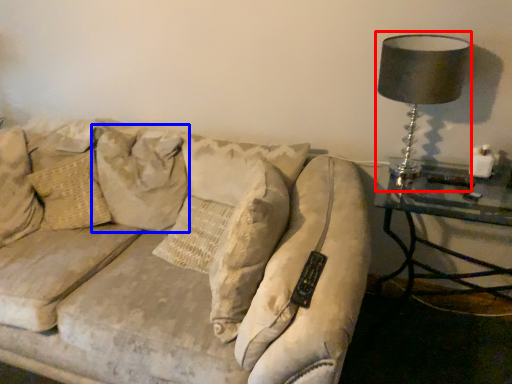
Question: Which object appears farthest to the camera in this image, table lamp (highlighted by a red box) or pillow (highlighted by a blue box)?

Choices:
 (A) table lamp
 (B) pillow

Answer: (B)